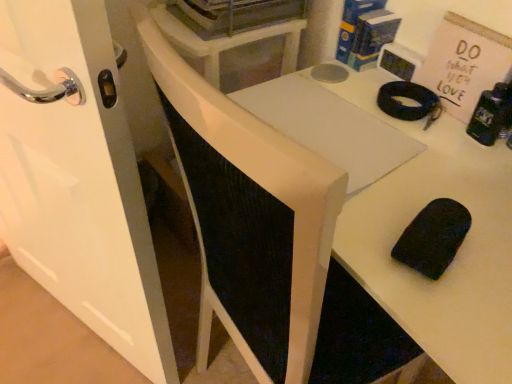
Question: Is metallic gray dishwasher at upper center, positioned as the first appliance in top-to-bottom order, to the left of matte black clock at upper right, the 1th appliance from the bottom, from the viewer's perspective?

Choices:
 (A) no
 (B) yes

Answer: (B)

Question: Is metallic gray dishwasher at upper center, positioned as the first appliance in top-to-bottom order, with matte black clock at upper right, which is the 2th appliance from left to right?

Choices:
 (A) no
 (B) yes

Answer: (A)

Question: Is metallic gray dishwasher at upper center, the first appliance in the left-to-right sequence, not within matte black clock at upper right, the first appliance from the right?

Choices:
 (A) yes
 (B) no

Answer: (A)

Question: Is metallic gray dishwasher at upper center, positioned as the first appliance in top-to-bottom order, surrounding matte black clock at upper right, the 1th appliance from the bottom?

Choices:
 (A) no
 (B) yes

Answer: (A)

Question: Is metallic gray dishwasher at upper center, which is the second appliance from right to left, looking in the opposite direction of matte black clock at upper right, which appears as the second appliance when viewed from the top?

Choices:
 (A) yes
 (B) no

Answer: (B)

Question: Does point (79, 213) appear closer or farther from the camera than point (497, 377)?

Choices:
 (A) farther
 (B) closer

Answer: (A)

Question: Do you think white glossy door at left is within white matte table at center, or outside of it?

Choices:
 (A) inside
 (B) outside

Answer: (B)

Question: From the image's perspective, is white glossy door at left located above or below white matte table at center?

Choices:
 (A) above
 (B) below

Answer: (A)

Question: Considering their positions, is white glossy door at left located in front of or behind white matte table at center?

Choices:
 (A) front
 (B) behind

Answer: (B)

Question: In the image, is metallic gray dishwasher at upper center, the 2th appliance in the bottom-to-top sequence, positioned in front of or behind matte black clock at upper right, which appears as the second appliance when viewed from the top?

Choices:
 (A) behind
 (B) front

Answer: (B)

Question: From a real-world perspective, relative to matte black clock at upper right, which is the 2th appliance from left to right, is metallic gray dishwasher at upper center, positioned as the first appliance in top-to-bottom order, vertically above or below?

Choices:
 (A) below
 (B) above

Answer: (B)

Question: Visually, is metallic gray dishwasher at upper center, the first appliance in the left-to-right sequence, positioned to the left or to the right of matte black clock at upper right, the 1th appliance from the bottom?

Choices:
 (A) left
 (B) right

Answer: (A)

Question: Considering the positions of point (241, 1) and point (413, 64), is point (241, 1) closer or farther from the camera than point (413, 64)?

Choices:
 (A) farther
 (B) closer

Answer: (A)

Question: Does point (360, 200) appear closer or farther from the camera than point (397, 71)?

Choices:
 (A) closer
 (B) farther

Answer: (A)

Question: Looking at their shapes, would you say white matte table at center is wider or thinner than matte black clock at upper right, the 1th appliance from the bottom?

Choices:
 (A) wide
 (B) thin

Answer: (A)